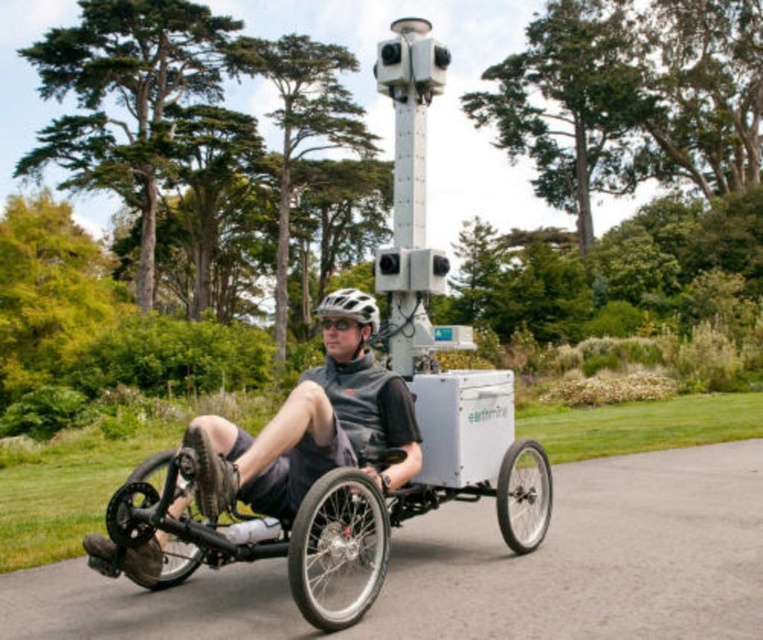
Can you confirm if matte black trike at center is bigger than shiny silver rim at center?

Yes, matte black trike at center is bigger than shiny silver rim at center.

Is point (391, 483) more distant than point (327, 497)?

That is True.

Where is `matte black trike at center`? matte black trike at center is located at coordinates pyautogui.click(x=308, y=432).

Who is higher up, matte black trike at center or white matte bicycle helmet at center?

white matte bicycle helmet at center

Does matte black trike at center appear on the right side of white matte bicycle helmet at center?

Indeed, matte black trike at center is positioned on the right side of white matte bicycle helmet at center.

Identify the location of matte black trike at center. (308, 432).

This screenshot has width=763, height=640. Identify the location of matte black trike at center. (308, 432).

Is black rubber wheel at lower right to the left of white matte bicycle helmet at center from the viewer's perspective?

Incorrect, black rubber wheel at lower right is not on the left side of white matte bicycle helmet at center.

Who is more distant from viewer, (x=539, y=492) or (x=369, y=310)?

Positioned behind is point (x=539, y=492).

This screenshot has width=763, height=640. What do you see at coordinates (523, 497) in the screenshot?
I see `black rubber wheel at lower right` at bounding box center [523, 497].

Identify the location of black rubber wheel at lower right. (523, 497).